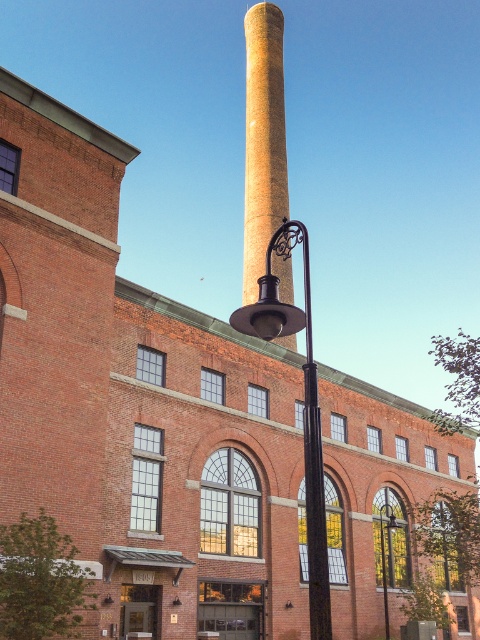
Question: Is yellowish brick chimney at center positioned in front of polished brass lamp post at center?

Choices:
 (A) yes
 (B) no

Answer: (B)

Question: Which point is closer to the camera?

Choices:
 (A) matte black lamp post at center
 (B) yellowish brick chimney at center
 (C) polished brass lamp post at center

Answer: (C)

Question: Which point is closer to the camera?

Choices:
 (A) polished brass lamp post at center
 (B) yellowish brick chimney at center

Answer: (A)

Question: Is yellowish brick chimney at center behind polished brass lamp post at center?

Choices:
 (A) yes
 (B) no

Answer: (A)

Question: Is yellowish brick chimney at center positioned at the back of matte black lamp post at center?

Choices:
 (A) yes
 (B) no

Answer: (A)

Question: Among these objects, which one is nearest to the camera?

Choices:
 (A) matte black lamp post at center
 (B) polished brass lamp post at center

Answer: (B)